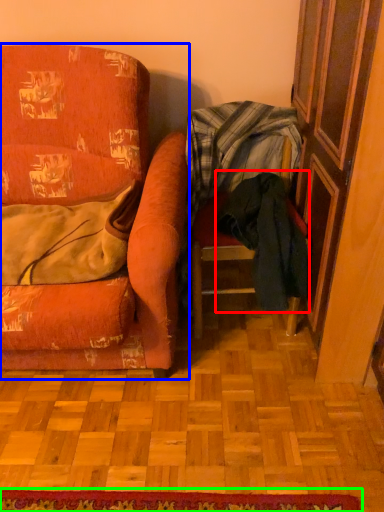
Question: Estimate the real-world distances between objects in this image. Which object is closer to clothing (highlighted by a red box), chair (highlighted by a blue box) or doormat (highlighted by a green box)?

Choices:
 (A) chair
 (B) doormat

Answer: (A)